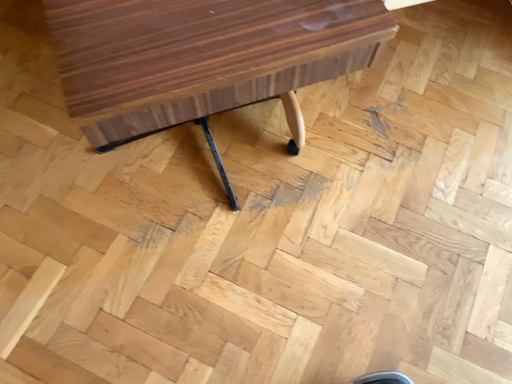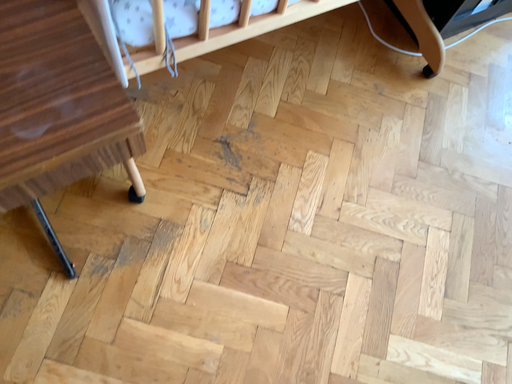
Question: How did the camera likely rotate when shooting the video?

Choices:
 (A) rotated right
 (B) rotated left

Answer: (A)